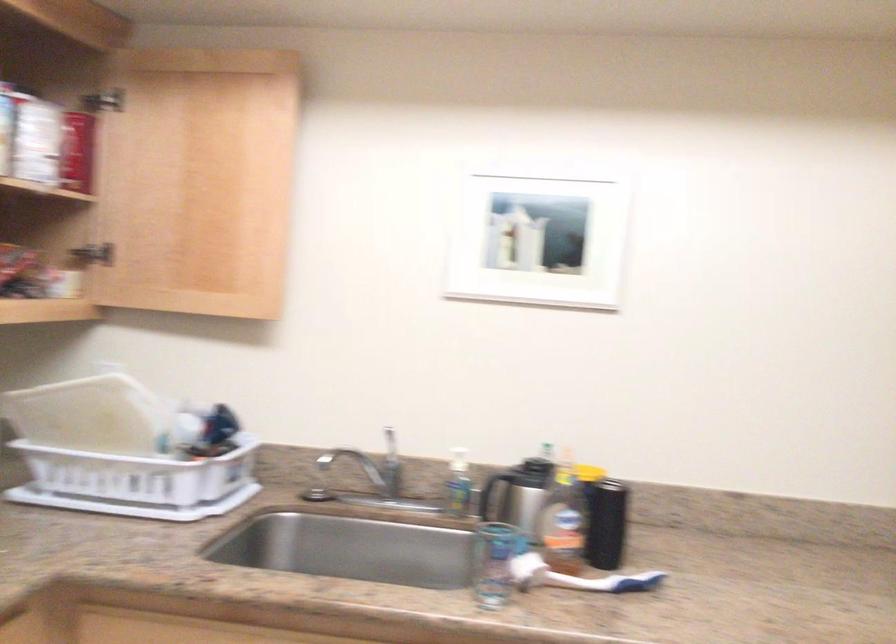
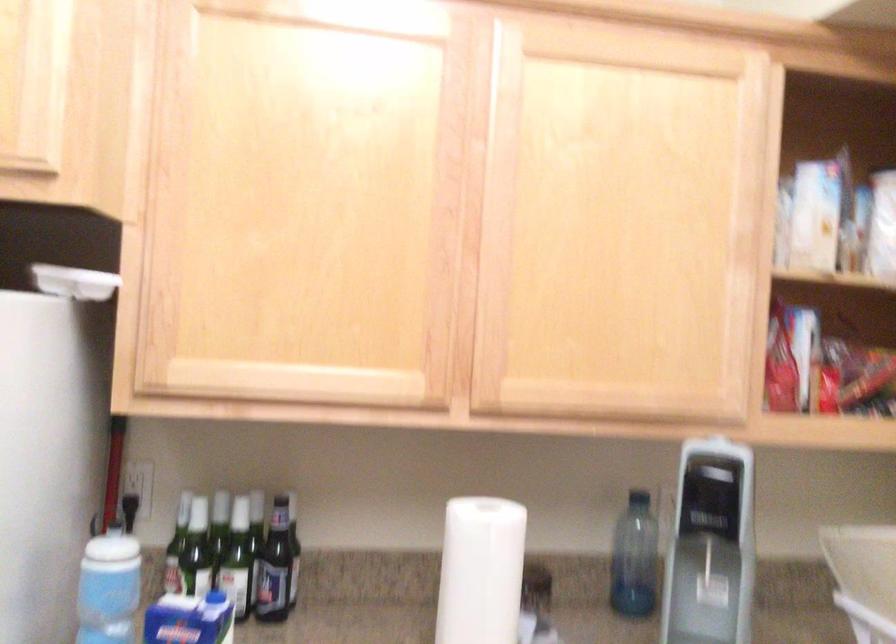
Question: The first image is from the beginning of the video and the second image is from the end. How did the camera likely rotate when shooting the video?

Choices:
 (A) Left
 (B) Right
 (C) Up
 (D) Down

Answer: (A)